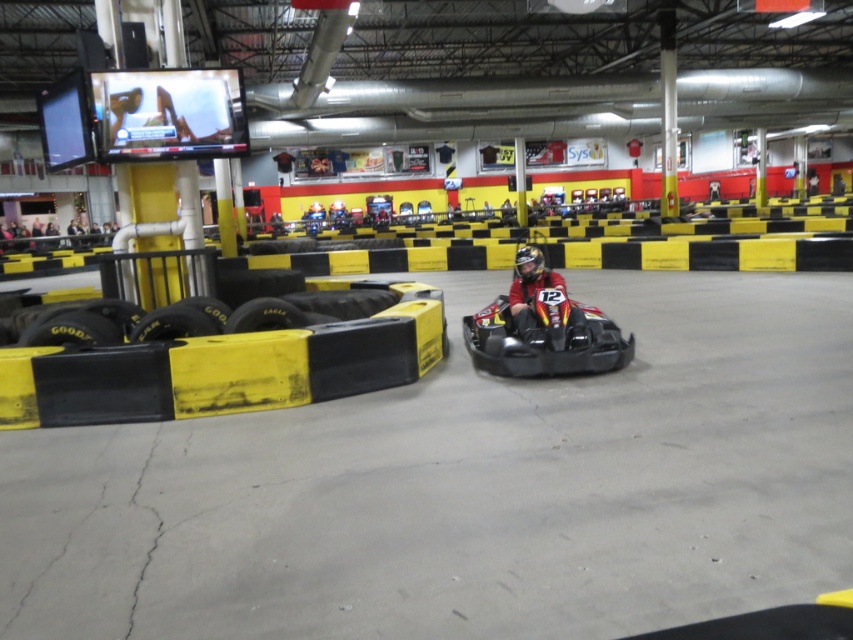
Consider the image. Who is taller, black rubber tire at center or black matte helmet at center?

With more height is black rubber tire at center.

Identify the location of black rubber tire at center. The width and height of the screenshot is (853, 640). (343, 301).

Which of these two, yellow rubber tire at lower left or black rubber tire at center, stands taller?

Standing taller between the two is black rubber tire at center.

Does point (73, 333) lie in front of point (378, 298)?

Yes, it is.

At what (x,y) coordinates should I click in order to perform the action: click on yellow rubber tire at lower left. Please return your answer as a coordinate pair (x, y). Looking at the image, I should click on (71, 328).

Does point (569, 371) come farther from viewer compared to point (26, 333)?

No, it is not.

What are the coordinates of `black matte go-kart at center` in the screenshot? It's located at coord(543,326).